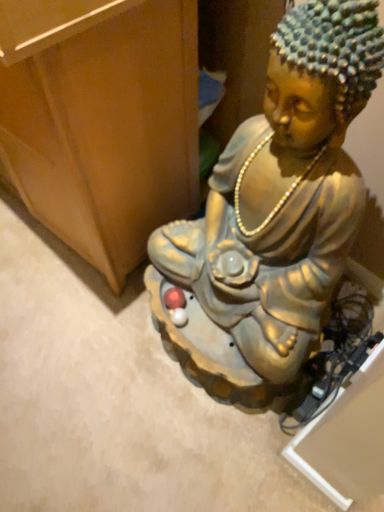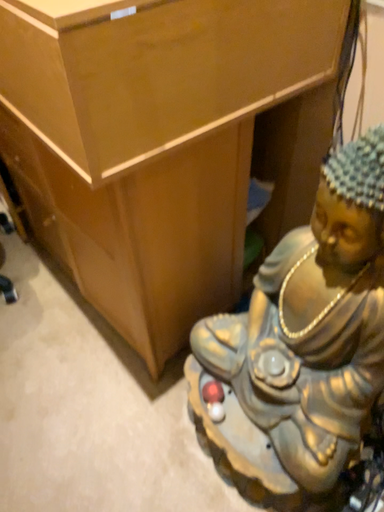
Question: How did the camera likely rotate when shooting the video?

Choices:
 (A) rotated upward
 (B) rotated downward

Answer: (A)